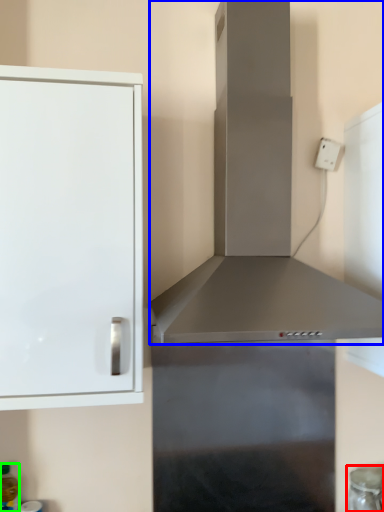
Question: Which object is positioned closest to appliance (highlighted by a red box)? Select from vent (highlighted by a blue box) and bottle (highlighted by a green box).

Choices:
 (A) vent
 (B) bottle

Answer: (A)